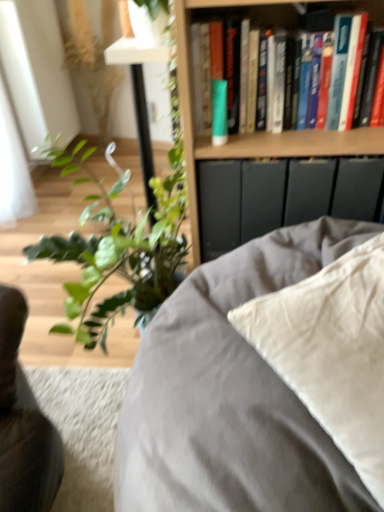
Question: Does satin beige pillow at center turn towards wooden bookshelf at upper center?

Choices:
 (A) no
 (B) yes

Answer: (A)

Question: Could wooden bookshelf at upper center be considered to be inside satin beige pillow at center?

Choices:
 (A) no
 (B) yes

Answer: (A)

Question: Does satin beige pillow at center have a lesser width compared to wooden bookshelf at upper center?

Choices:
 (A) no
 (B) yes

Answer: (A)

Question: Is satin beige pillow at center far from wooden bookshelf at upper center?

Choices:
 (A) no
 (B) yes

Answer: (A)

Question: From a real-world perspective, is satin beige pillow at center on wooden bookshelf at upper center?

Choices:
 (A) no
 (B) yes

Answer: (A)

Question: Is satin beige pillow at center facing away from wooden bookshelf at upper center?

Choices:
 (A) yes
 (B) no

Answer: (A)

Question: Can you confirm if green matte tube at upper center is thinner than wooden bookshelf at upper center?

Choices:
 (A) no
 (B) yes

Answer: (B)

Question: Would you say green matte tube at upper center is a long distance from wooden bookshelf at upper center?

Choices:
 (A) no
 (B) yes

Answer: (A)

Question: Is green matte tube at upper center in contact with wooden bookshelf at upper center?

Choices:
 (A) yes
 (B) no

Answer: (B)

Question: From a real-world perspective, is green matte tube at upper center below wooden bookshelf at upper center?

Choices:
 (A) no
 (B) yes

Answer: (A)

Question: Can you confirm if green matte tube at upper center is shorter than wooden bookshelf at upper center?

Choices:
 (A) no
 (B) yes

Answer: (B)

Question: Could you tell me if green matte tube at upper center is turned towards wooden bookshelf at upper center?

Choices:
 (A) yes
 (B) no

Answer: (A)

Question: Can we say hardcover books at upper right lies outside green matte tube at upper center?

Choices:
 (A) yes
 (B) no

Answer: (A)